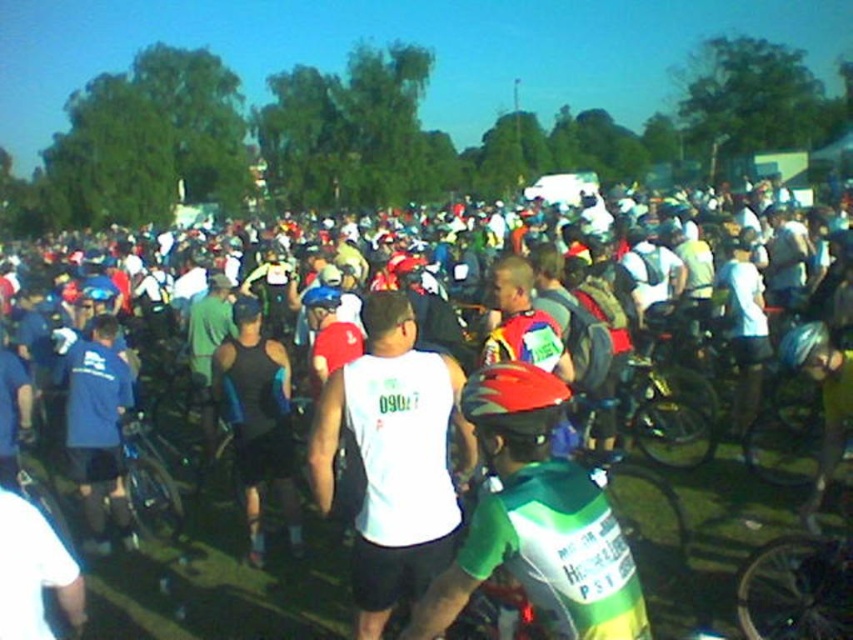
You are standing at the edge of the crowd watching the cycling event. There is a green jersey at center that you want to take a photo of. If you can only move forward 2 meters, will you be close enough to get a clear shot?

The green jersey at center is 2.40 meters away from you. Since you can only move forward 2 meters, you would still be 0.40 meters away, which might not be close enough for a clear shot depending on your camera. However, moving as close as possible would help.

Based on the photo, you are a photographer at the cycling event. You want to capture a photo where both the green jersey at center and the shiny red helmet at center are visible. Given their sizes, which object should you focus on to ensure both are in frame without zooming in too much?

The green jersey at center has a larger size compared to the shiny red helmet at center. To ensure both are visible without excessive zoom, focus on the larger green jersey at center, as its size will allow the helmet to remain in frame.